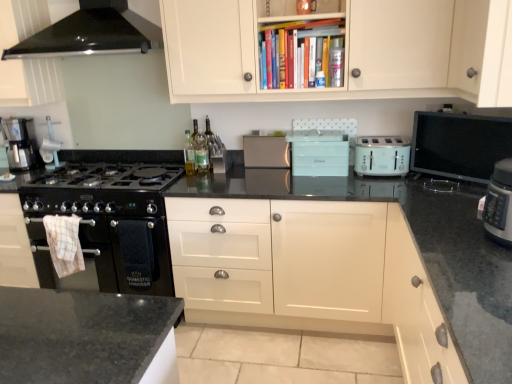
At what (x,y) coordinates should I click in order to perform the action: click on free location above flat screen tv at right, arranged as the 1th appliance when viewed from the right (from a real-world perspective). Please return your answer as a coordinate pair (x, y). Looking at the image, I should click on (460, 118).